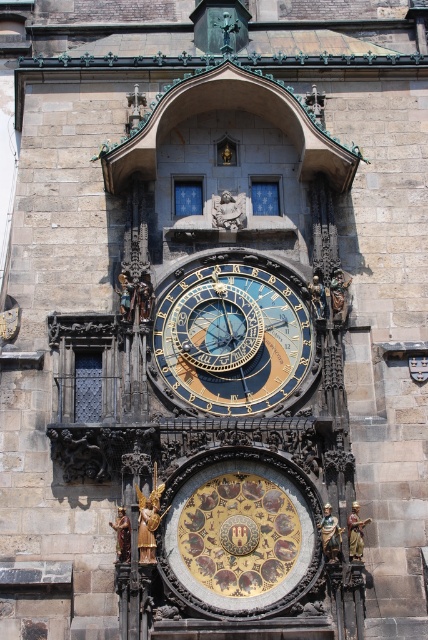
You are an art student analyzing the Prague Astronomical Clock. You observe the gold metallic clock at center and the gold metallic statue at center. Which object has a greater width?

The gold metallic clock at center has a greater width than the gold metallic statue at center.

You are standing 10 meters away from the gold metallic statue at center. Can you see the gold metallic clock at center from your current position?

The gold metallic clock at center is 11.76 meters away from the gold metallic statue at center. Since you are 10 meters away from the statue, you are still within the 11.76 meters distance to the clock, so yes, you can see the gold metallic clock at center from your current position.